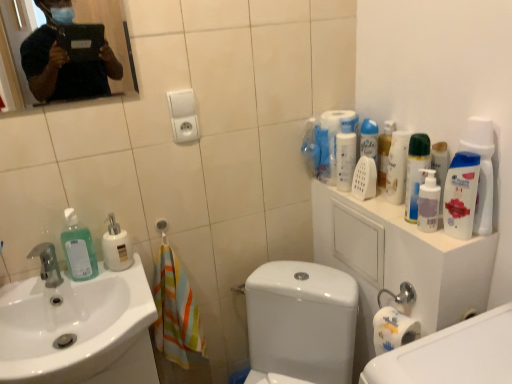
Question: Considering the positions of matte black tablet at upper left and translucent plastic mouthwash at upper right, acting as the 2th mouthwash starting from the front, in the image, is matte black tablet at upper left wider or thinner than translucent plastic mouthwash at upper right, acting as the 2th mouthwash starting from the front,?

Choices:
 (A) thin
 (B) wide

Answer: (A)

Question: From a real-world perspective, is matte black tablet at upper left above or below translucent plastic mouthwash at upper right, the first mouthwash viewed from the left?

Choices:
 (A) above
 (B) below

Answer: (A)

Question: Which of these objects is positioned closest to the white glossy bottle at upper right, which is counted as the 3th cleaning product, starting from the right?

Choices:
 (A) translucent plastic mouthwash at upper right, acting as the 2th mouthwash starting from the front
 (B) white matte pump bottle at right, the 6th cleaning product positioned from the left
 (C) white glossy bottle at upper right, the 4th cleaning product positioned from the right
 (D) matte black tablet at upper left
 (E) white glossy sink at lower left

Answer: (A)

Question: Which object is the closest to the matte black tablet at upper left?

Choices:
 (A) white glossy bottle at upper right, which is counted as the 3th cleaning product, starting from the right
 (B) white glossy sink at lower left
 (C) white matte pump bottle at right, the 6th cleaning product positioned from the left
 (D) white glossy mouthwash at upper right, which is the first mouthwash from right to left
 (E) white glossy soap dispenser at left, which is the fifth cleaning product from right to left

Answer: (E)